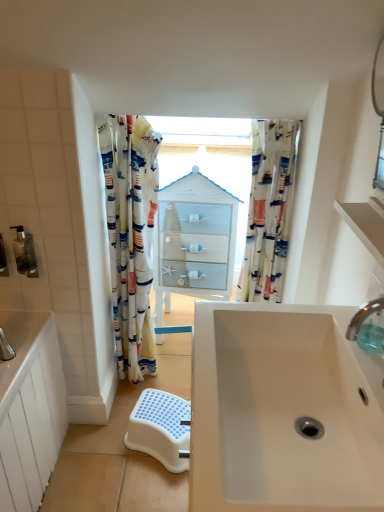
The width and height of the screenshot is (384, 512). Identify the location of white matte shelf at upper right. (365, 226).

Measure the distance between clear plastic tap at upper right and camera.

clear plastic tap at upper right is 38.66 inches away from camera.

Identify the location of printed fabric shower curtain at left, placed as the 1th curtain when sorted from left to right. The height and width of the screenshot is (512, 384). (131, 234).

At what (x,y) coordinates should I click in order to perform the action: click on printed fabric curtain at center, marked as the first curtain in a right-to-left arrangement. Please return your answer as a coordinate pair (x, y). This screenshot has width=384, height=512. Looking at the image, I should click on (269, 209).

Find the location of a particular element. The image size is (384, 512). white matte shelf at upper right is located at coordinates (365, 226).

Is white glossy cabinet at center wider or thinner than white matte sink at center?

white glossy cabinet at center is thinner than white matte sink at center.

Which is more to the left, white glossy cabinet at center or white matte sink at center?

From the viewer's perspective, white glossy cabinet at center appears more on the left side.

In the image, there is a white glossy cabinet at center. Where is `sink below it (from the image's perspective)`? Image resolution: width=384 pixels, height=512 pixels. sink below it (from the image's perspective) is located at coordinates 283,411.

Does white glossy cabinet at center contain white matte sink at center?

No, white glossy cabinet at center does not contain white matte sink at center.

How distant is white matte sink at center from clear plastic tap at upper right?

They are 9.69 inches apart.

Is white matte sink at center positioned behind clear plastic tap at upper right?

That is False.

Who is shorter, white matte sink at center or clear plastic tap at upper right?

With less height is white matte sink at center.

Is white matte sink at center positioned beyond the bounds of clear plastic tap at upper right?

Yes, white matte sink at center is outside of clear plastic tap at upper right.

Is translucent plastic soap dispenser at left, the first toiletry when ordered from right to left, shorter than white glossy cabinet at center?

Correct, translucent plastic soap dispenser at left, the first toiletry when ordered from right to left, is not as tall as white glossy cabinet at center.

Can you confirm if translucent plastic soap dispenser at left, positioned as the second toiletry in left-to-right order, is thinner than white glossy cabinet at center?

Indeed, translucent plastic soap dispenser at left, positioned as the second toiletry in left-to-right order, has a lesser width compared to white glossy cabinet at center.

How different are the orientations of translucent plastic soap dispenser at left, positioned as the second toiletry in left-to-right order, and white glossy cabinet at center in degrees?

2.57 degrees separate the facing orientations of translucent plastic soap dispenser at left, positioned as the second toiletry in left-to-right order, and white glossy cabinet at center.

From the picture: Does translucent plastic soap dispenser at left, positioned as the second toiletry in left-to-right order, turn towards white glossy cabinet at center?

No, translucent plastic soap dispenser at left, positioned as the second toiletry in left-to-right order, is not oriented towards white glossy cabinet at center.

The image size is (384, 512). What are the coordinates of `sink that is below the printed fabric shower curtain at left, the second curtain positioned from the right (from the image's perspective)` in the screenshot? It's located at (283, 411).

Does white matte sink at center appear on the left side of printed fabric shower curtain at left, the second curtain positioned from the right?

No, white matte sink at center is not to the left of printed fabric shower curtain at left, the second curtain positioned from the right.

Considering the relative sizes of white matte sink at center and printed fabric shower curtain at left, placed as the 1th curtain when sorted from left to right, in the image provided, is white matte sink at center taller than printed fabric shower curtain at left, placed as the 1th curtain when sorted from left to right,?

In fact, white matte sink at center may be shorter than printed fabric shower curtain at left, placed as the 1th curtain when sorted from left to right.

From the picture: Can you tell me how much white matte sink at center and printed fabric shower curtain at left, placed as the 1th curtain when sorted from left to right, differ in facing direction?

89.4 degrees.

In terms of height, does printed fabric shower curtain at left, placed as the 1th curtain when sorted from left to right, look taller or shorter compared to white plastic step stool at lower center?

Clearly, printed fabric shower curtain at left, placed as the 1th curtain when sorted from left to right, is taller compared to white plastic step stool at lower center.

From the picture: Is printed fabric shower curtain at left, the second curtain positioned from the right, facing towards white plastic step stool at lower center?

Yes, printed fabric shower curtain at left, the second curtain positioned from the right, is aimed at white plastic step stool at lower center.

Where is `curtain that appears on the left of white plastic step stool at lower center`? The width and height of the screenshot is (384, 512). curtain that appears on the left of white plastic step stool at lower center is located at coordinates (131, 234).

Are printed fabric shower curtain at left, the second curtain positioned from the right, and white plastic step stool at lower center far apart?

printed fabric shower curtain at left, the second curtain positioned from the right, is near white plastic step stool at lower center, not far away.

Can you see printed fabric shower curtain at left, placed as the 1th curtain when sorted from left to right, touching white matte sink at center?

No, printed fabric shower curtain at left, placed as the 1th curtain when sorted from left to right, is not beside white matte sink at center.

Is printed fabric shower curtain at left, the second curtain positioned from the right, situated inside white matte sink at center or outside?

printed fabric shower curtain at left, the second curtain positioned from the right, is not enclosed by white matte sink at center.

From the image's perspective, count 1st curtains upward from the white matte sink at center and point to it. Please provide its 2D coordinates.

[(131, 234)]

Consider the image. From a real-world perspective, which object stands above the other?

translucent plastic soap dispenser at left, acting as the first toiletry starting from the left, is physically above.

From a real-world perspective, starting from the translucent plastic soap dispenser at left, marked as the second toiletry in a right-to-left arrangement, which curtain is the 1st one below it? Please provide its 2D coordinates.

[(269, 209)]

Can you confirm if translucent plastic soap dispenser at left, marked as the second toiletry in a right-to-left arrangement, is positioned to the right of printed fabric curtain at center, marked as the first curtain in a right-to-left arrangement?

In fact, translucent plastic soap dispenser at left, marked as the second toiletry in a right-to-left arrangement, is to the left of printed fabric curtain at center, marked as the first curtain in a right-to-left arrangement.

Which is behind, point (4, 260) or point (278, 175)?

The point (278, 175) is behind.

The image size is (384, 512). Identify the location of medicine cabinet above the white matte sink at center (from the image's perspective). (194, 240).

I want to click on sink located in front of the clear plastic tap at upper right, so coord(283,411).

From the image, which object appears to be farther from printed fabric shower curtain at left, the second curtain positioned from the right, translucent plastic soap dispenser at left, acting as the first toiletry starting from the left, or white plastic step stool at lower center?

translucent plastic soap dispenser at left, acting as the first toiletry starting from the left, is positioned further to the anchor printed fabric shower curtain at left, the second curtain positioned from the right.

Consider the image. Looking at the image, which one is located further to white matte shelf at upper right, printed fabric shower curtain at left, the second curtain positioned from the right, or translucent plastic soap dispenser at left, marked as the second toiletry in a right-to-left arrangement?

The object further to white matte shelf at upper right is translucent plastic soap dispenser at left, marked as the second toiletry in a right-to-left arrangement.

Consider the image. From the image, which object appears to be nearer to translucent plastic soap dispenser at left, marked as the second toiletry in a right-to-left arrangement, white matte shelf at upper right or printed fabric shower curtain at left, the second curtain positioned from the right?

The object closer to translucent plastic soap dispenser at left, marked as the second toiletry in a right-to-left arrangement, is printed fabric shower curtain at left, the second curtain positioned from the right.

When comparing their distances from white plastic step stool at lower center, does translucent plastic soap dispenser at left, the first toiletry when ordered from right to left, or white matte sink at center seem further?

Among the two, white matte sink at center is located further to white plastic step stool at lower center.

Based on their spatial positions, is white matte shelf at upper right or clear plastic tap at upper right further from printed fabric shower curtain at left, the second curtain positioned from the right?

clear plastic tap at upper right lies further to printed fabric shower curtain at left, the second curtain positioned from the right, than the other object.

Based on their spatial positions, is white matte shelf at upper right or printed fabric curtain at center, acting as the 2th curtain starting from the left, further from white plastic step stool at lower center?

white matte shelf at upper right is positioned further to the anchor white plastic step stool at lower center.

In the scene shown: Considering their positions, is printed fabric curtain at center, marked as the first curtain in a right-to-left arrangement, positioned further to white plastic step stool at lower center than printed fabric shower curtain at left, placed as the 1th curtain when sorted from left to right?

Based on the image, printed fabric curtain at center, marked as the first curtain in a right-to-left arrangement, appears to be further to white plastic step stool at lower center.

When comparing their distances from translucent plastic soap dispenser at left, marked as the second toiletry in a right-to-left arrangement, does white matte shelf at upper right or white matte sink at center seem further?

white matte shelf at upper right lies further to translucent plastic soap dispenser at left, marked as the second toiletry in a right-to-left arrangement, than the other object.

The width and height of the screenshot is (384, 512). What are the coordinates of `toiletry between translucent plastic soap dispenser at left, marked as the second toiletry in a right-to-left arrangement, and printed fabric curtain at center, marked as the first curtain in a right-to-left arrangement` in the screenshot? It's located at (25, 253).

Locate an element on the screen. The width and height of the screenshot is (384, 512). curtain between translucent plastic soap dispenser at left, positioned as the second toiletry in left-to-right order, and white glossy cabinet at center from left to right is located at coordinates (131, 234).

This screenshot has height=512, width=384. I want to click on step stool between white matte shelf at upper right and white glossy cabinet at center in the front-back direction, so click(x=161, y=428).

Find the location of a particular element. curtain that lies between translucent plastic soap dispenser at left, acting as the first toiletry starting from the left, and white plastic step stool at lower center from top to bottom is located at coordinates (131, 234).